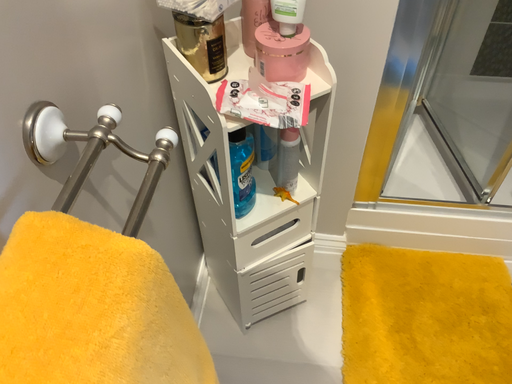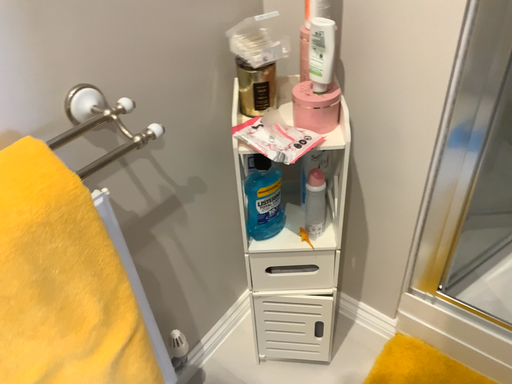
Question: How did the camera likely rotate when shooting the video?

Choices:
 (A) rotated right
 (B) rotated left

Answer: (B)